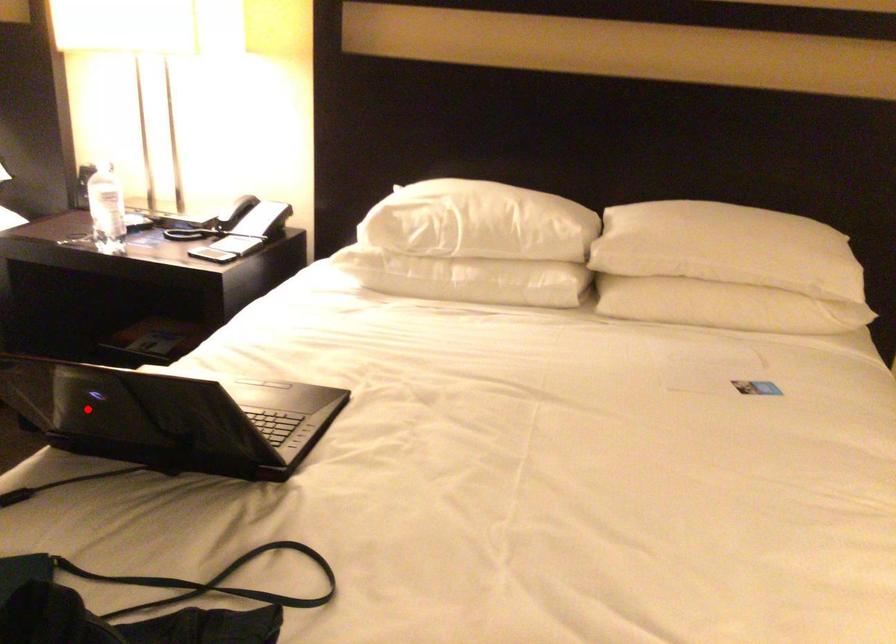
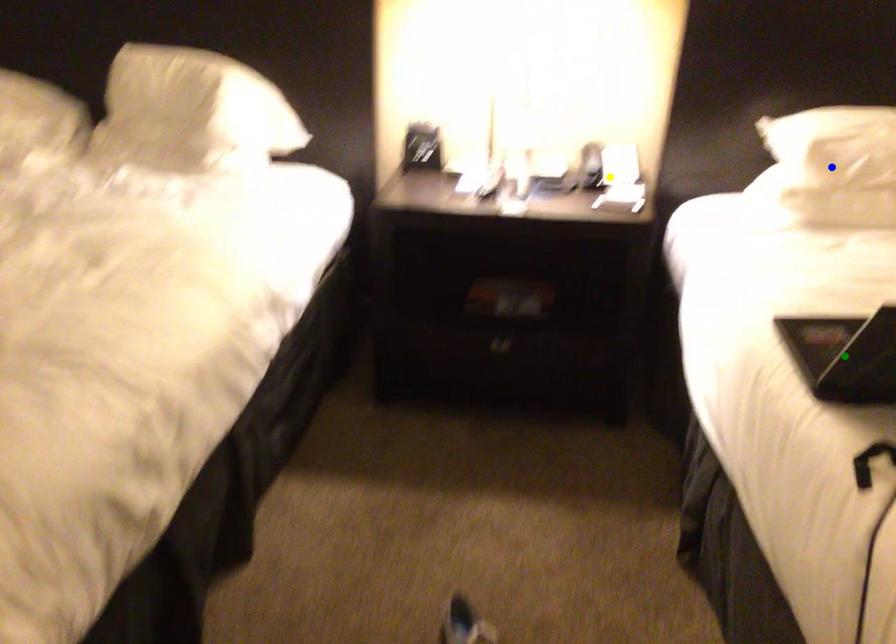
Question: I am providing you with two images of the same scene from different viewpoints. A red point is marked on the first image. You are given multiple points on the second image. Which point in image 2 is actually the same real-world point as the red point in image 1?

Choices:
 (A) blue point
 (B) green point
 (C) yellow point

Answer: (B)